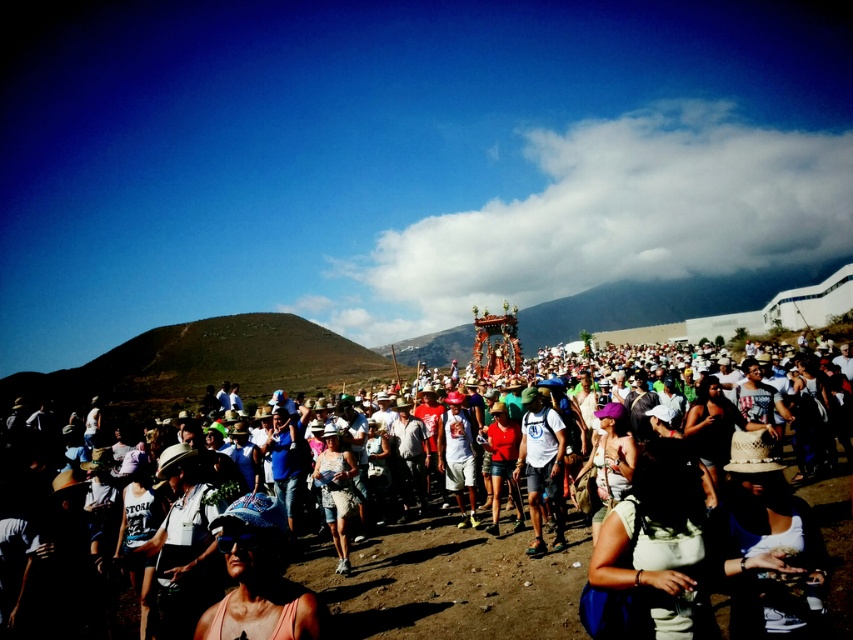
Is point (521, 605) more distant than point (560, 490)?

No, (521, 605) is in front of (560, 490).

Does point (509, 625) come in front of point (538, 438)?

Yes, point (509, 625) is in front of point (538, 438).

Is point (820, 500) positioned after point (553, 481)?

No, (820, 500) is closer to viewer.

The width and height of the screenshot is (853, 640). I want to click on matte white crowd at center, so click(x=450, y=580).

Is matte white crowd at center below white cotton shorts at center?

No, matte white crowd at center is not below white cotton shorts at center.

The image size is (853, 640). What do you see at coordinates (450, 580) in the screenshot?
I see `matte white crowd at center` at bounding box center [450, 580].

Locate an element on the screen. matte white crowd at center is located at coordinates (450, 580).

Is point (540, 518) farther from viewer compared to point (344, 497)?

No.

Does point (521, 388) lie in front of point (339, 504)?

No, (521, 388) is behind (339, 504).

This screenshot has width=853, height=640. I want to click on white matte t-shirt at center, so click(x=541, y=465).